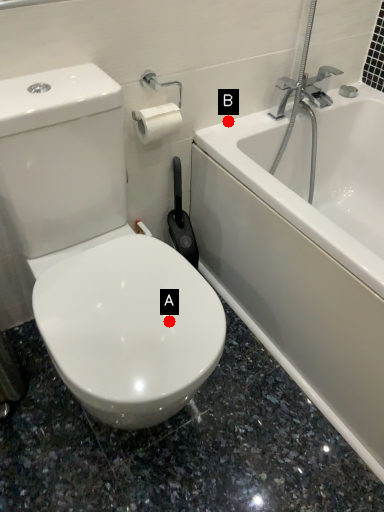
Question: Two points are circled on the image, labeled by A and B beside each circle. Which point appears closest to the camera in this image?

Choices:
 (A) A is closer
 (B) B is closer

Answer: (A)